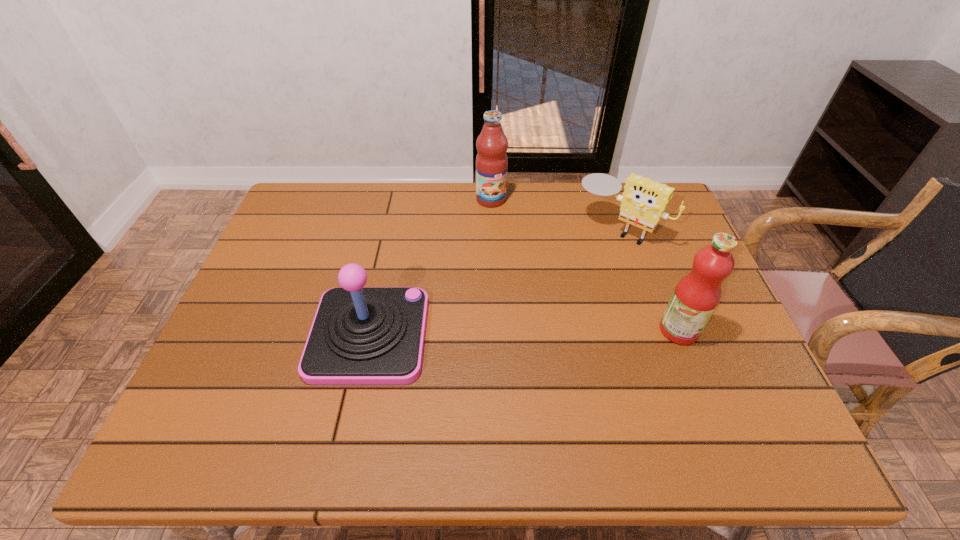
At what (x,y) coordinates should I click in order to perform the action: click on vacant spot on the desktop that is between the second shortest object and the nearer fruit juice and is positioned on the front-facing side of the shortest object. Please return your answer as a coordinate pair (x, y). The width and height of the screenshot is (960, 540). Looking at the image, I should click on (529, 333).

Identify the location of vacant space on the desktop that is between the leftmost object and the right fruit juice and is positioned on the front label of the farther fruit juice. (564, 332).